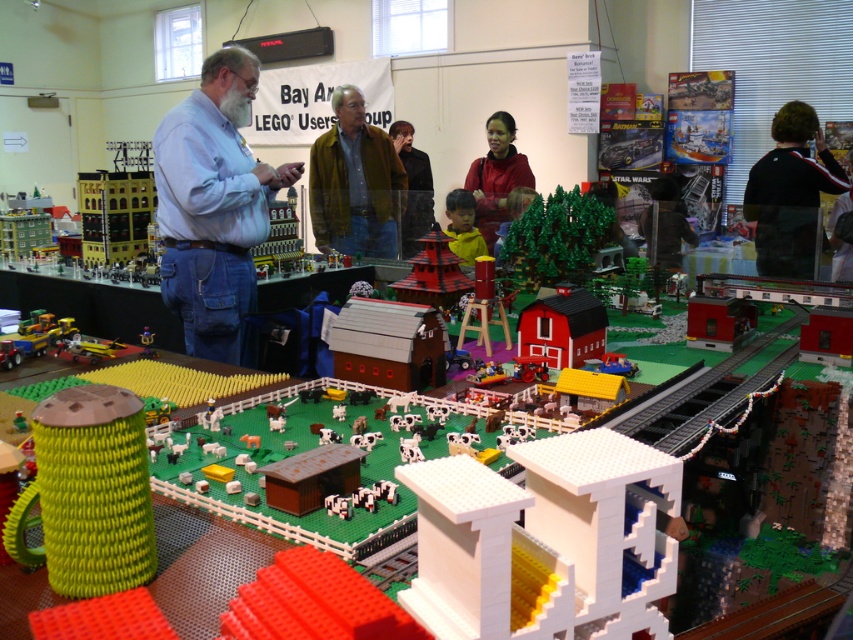
Question: Is blue shirt at center positioned in front of yellow matte shirt at center?

Choices:
 (A) yes
 (B) no

Answer: (A)

Question: Which of these objects is positioned farthest from the black fabric at upper right?

Choices:
 (A) green woven mug at center
 (B) matte red sweater at center
 (C) brown woolen sweater at center

Answer: (A)

Question: Which point is closer to the camera?

Choices:
 (A) black fabric jacket at upper right
 (B) brown woolen sweater at center
 (C) matte red sweater at center

Answer: (A)

Question: Does blue shirt at center lie behind matte red sweater at center?

Choices:
 (A) no
 (B) yes

Answer: (A)

Question: In this image, where is brown woolen sweater at center located relative to matte red sweater at center?

Choices:
 (A) right
 (B) left

Answer: (B)

Question: Based on their relative distances, which object is nearer to the black fabric jacket at upper right?

Choices:
 (A) yellow matte shirt at center
 (B) black fabric at upper right
 (C) brick-like pagoda at center
 (D) brown woolen sweater at center

Answer: (B)